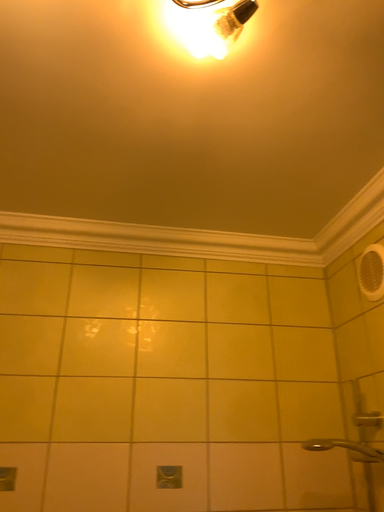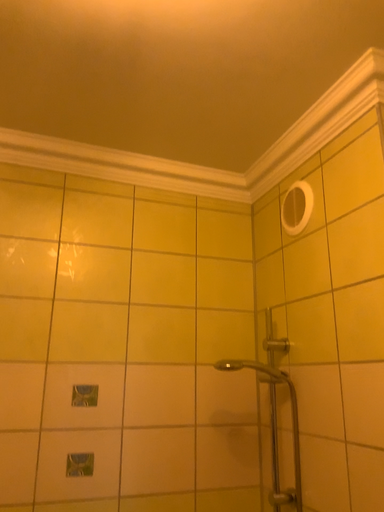
Question: How did the camera likely rotate when shooting the video?

Choices:
 (A) rotated downward
 (B) rotated upward

Answer: (A)